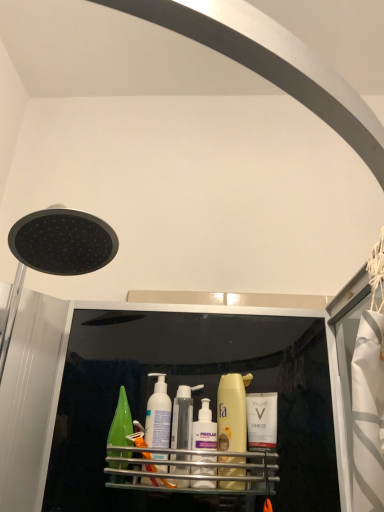
Question: From the image's perspective, is black matte shower head at upper left beneath translucent plastic bottles at center, the 3th toiletry in the right-to-left sequence?

Choices:
 (A) no
 (B) yes

Answer: (A)

Question: Would you consider black matte shower head at upper left to be distant from translucent plastic bottles at center, the 3th toiletry in the right-to-left sequence?

Choices:
 (A) yes
 (B) no

Answer: (B)

Question: From a real-world perspective, is black matte shower head at upper left positioned under translucent plastic bottles at center, the 3th toiletry in the right-to-left sequence, based on gravity?

Choices:
 (A) yes
 (B) no

Answer: (B)

Question: Does black matte shower head at upper left have a greater width compared to translucent plastic bottles at center, the 3th toiletry in the right-to-left sequence?

Choices:
 (A) yes
 (B) no

Answer: (A)

Question: From a real-world perspective, is black matte shower head at upper left on top of translucent plastic bottles at center, the 3th toiletry in the right-to-left sequence?

Choices:
 (A) no
 (B) yes

Answer: (B)

Question: Is black matte shower head at upper left shorter than translucent plastic bottles at center, placed as the first toiletry when sorted from left to right?

Choices:
 (A) no
 (B) yes

Answer: (A)

Question: Considering the relative positions of black matte shower head at upper left and white plastic pump bottle at center, marked as the 2th toiletry in a left-to-right arrangement, in the image provided, is black matte shower head at upper left to the left of white plastic pump bottle at center, marked as the 2th toiletry in a left-to-right arrangement, from the viewer's perspective?

Choices:
 (A) yes
 (B) no

Answer: (A)

Question: From a real-world perspective, is black matte shower head at upper left positioned under white plastic pump bottle at center, the second toiletry from the right, based on gravity?

Choices:
 (A) no
 (B) yes

Answer: (A)

Question: From the image's perspective, does black matte shower head at upper left appear lower than white plastic pump bottle at center, the second toiletry from the right?

Choices:
 (A) yes
 (B) no

Answer: (B)

Question: Is black matte shower head at upper left oriented away from white plastic pump bottle at center, the second toiletry from the right?

Choices:
 (A) yes
 (B) no

Answer: (B)

Question: Is black matte shower head at upper left at the right side of white plastic pump bottle at center, marked as the 2th toiletry in a left-to-right arrangement?

Choices:
 (A) no
 (B) yes

Answer: (A)

Question: Is black matte shower head at upper left oriented towards white plastic pump bottle at center, marked as the 2th toiletry in a left-to-right arrangement?

Choices:
 (A) yes
 (B) no

Answer: (B)

Question: Would you say metallic silver shelf at center contains white matte vichy bottle at center, the 1th toiletry in the right-to-left sequence?

Choices:
 (A) yes
 (B) no

Answer: (A)